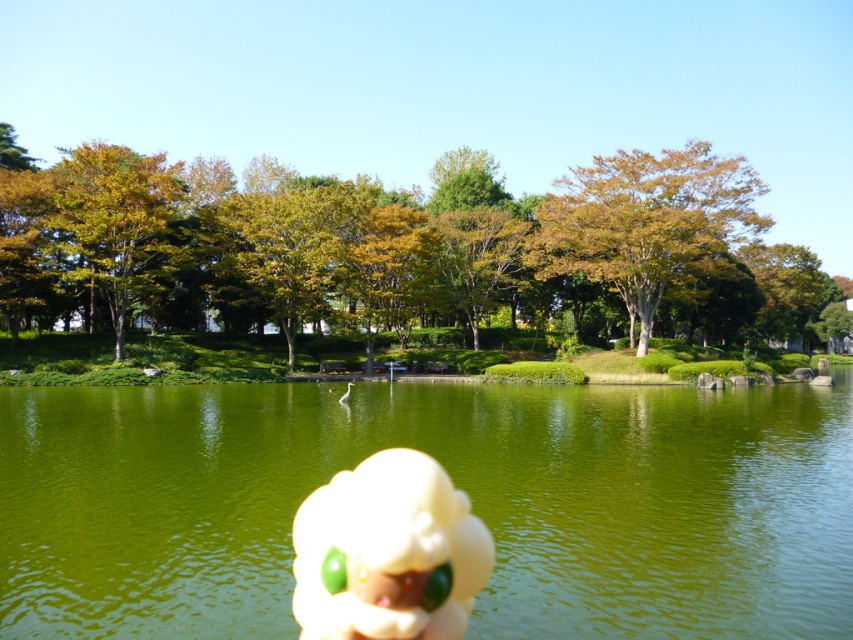
Does point (325, 544) come closer to viewer compared to point (701, 168)?

Yes, it is in front of point (701, 168).

Is white plush toy at center positioned in front of brown/leathery tree at upper right?

Yes, it is in front of brown/leathery tree at upper right.

Where is `white plush toy at center`? Image resolution: width=853 pixels, height=640 pixels. white plush toy at center is located at coordinates [387, 552].

Between golden-brown foliage at center and golden-brown foliage at upper left, which one is positioned higher?

golden-brown foliage at upper left

Who is more distant from viewer, (512, 273) or (76, 152)?

The point (512, 273) is more distant.

The height and width of the screenshot is (640, 853). I want to click on golden-brown foliage at center, so click(398, 248).

Does white plush toy at center appear on the right side of golden-brown foliage at upper left?

Indeed, white plush toy at center is positioned on the right side of golden-brown foliage at upper left.

Can you confirm if white plush toy at center is wider than golden-brown foliage at upper left?

In fact, white plush toy at center might be narrower than golden-brown foliage at upper left.

Identify the location of white plush toy at center. (387, 552).